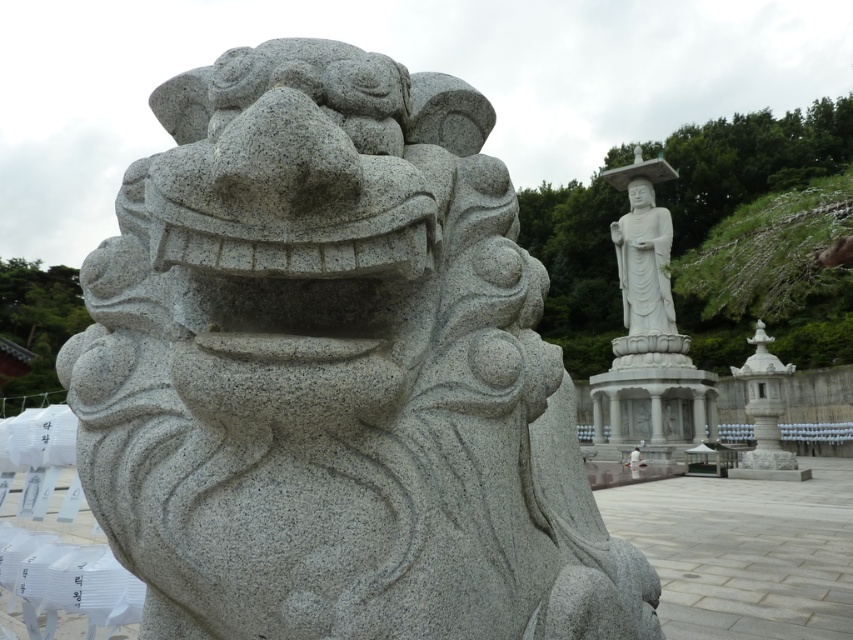
From the picture: You are an art conservator examining the stone sculptures in the scene. You need to assess the granite statue at center and the white stone statue at upper center. Which one is positioned higher in the image?

The granite statue at center is located above the white stone statue at upper center, so the granite statue at center is positioned higher in the image.

Consider the image. You are standing in front of the stone sculpture of a mythical creature. There is a point marked at coordinates [335,371]. Based on the scene description, can you determine what object this point is located on?

The point at coordinates [335,371] is located on the granite statue at center, as stated in the objects description.